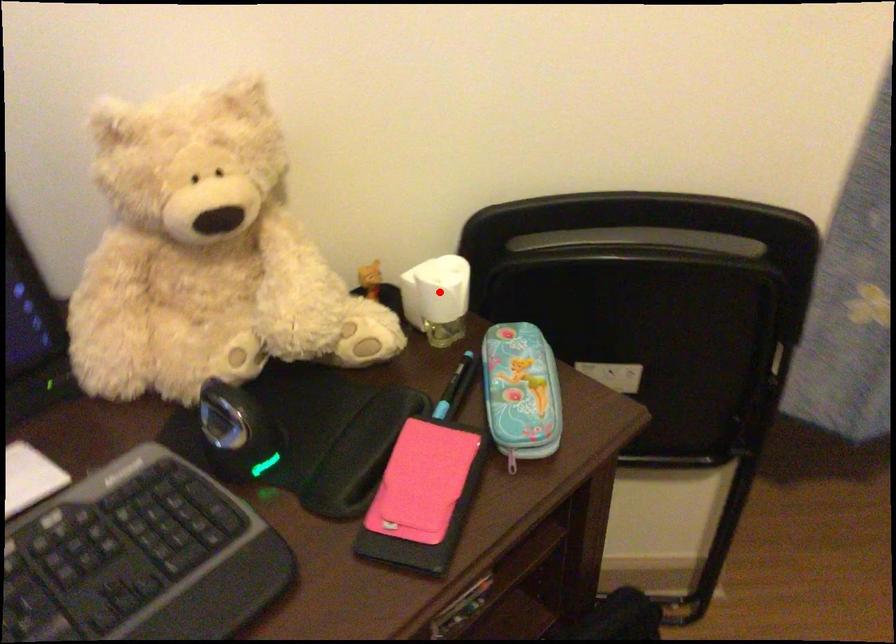
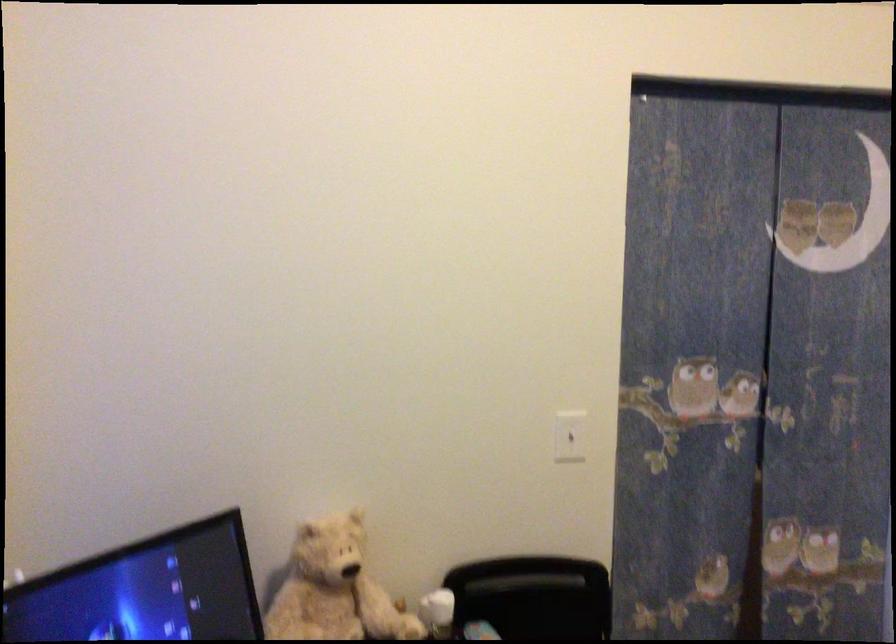
The point at the highlighted location is marked in the first image. Where is the corresponding point in the second image?

(437, 612)